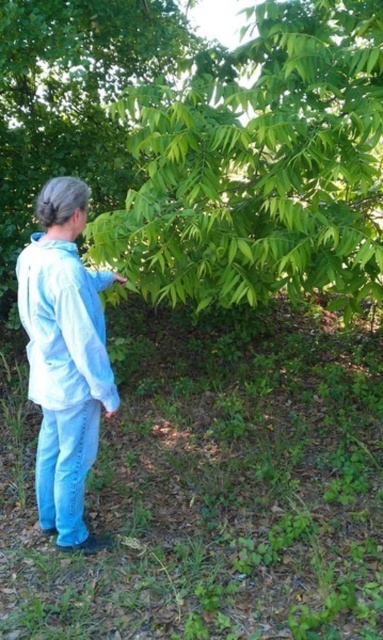
Question: Can you confirm if green leafy tree at center is thinner than light blue denim pants at lower left?

Choices:
 (A) yes
 (B) no

Answer: (B)

Question: Which of the following is the farthest from the observer?

Choices:
 (A) (58, 513)
 (B) (134, 260)

Answer: (B)

Question: Does green leafy tree at center have a larger size compared to light blue denim pants at lower left?

Choices:
 (A) no
 (B) yes

Answer: (B)

Question: Which object appears farthest from the camera in this image?

Choices:
 (A) green leafy tree at center
 (B) light blue denim pants at lower left

Answer: (A)

Question: Is green leafy tree at center wider than light blue denim pants at lower left?

Choices:
 (A) no
 (B) yes

Answer: (B)